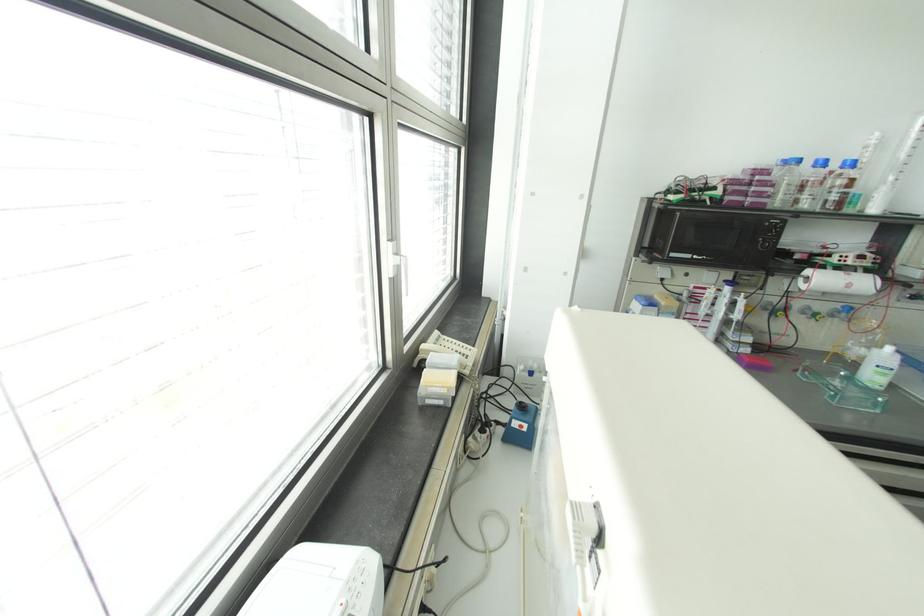
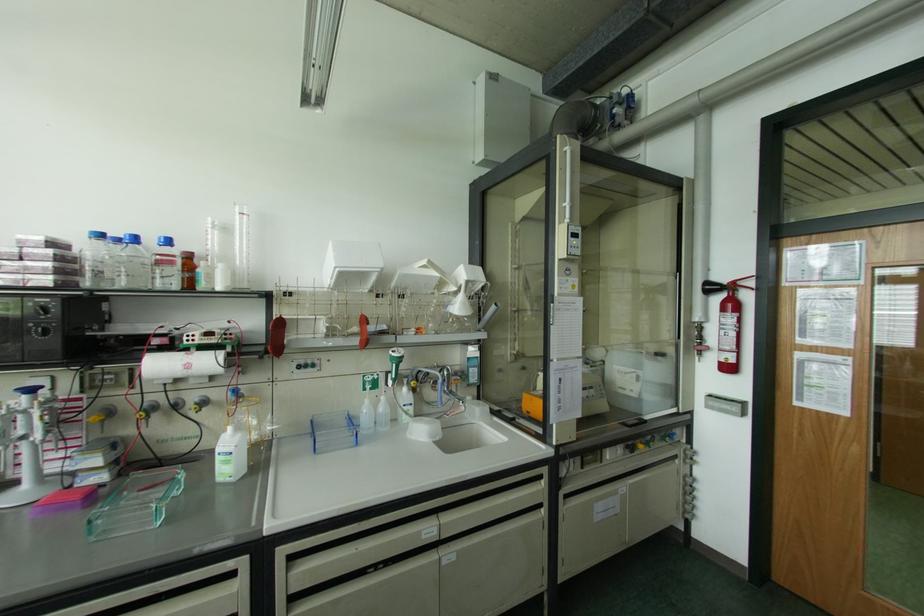
Where in the second image is the point corresponding to pixel 852 163 from the first image?

(167, 241)